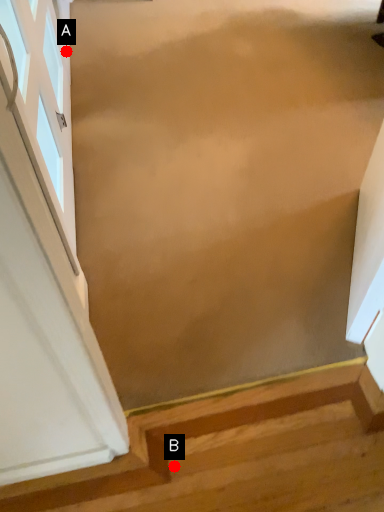
Question: Two points are circled on the image, labeled by A and B beside each circle. Among these points, which one is farthest from the camera?

Choices:
 (A) A is further
 (B) B is further

Answer: (A)